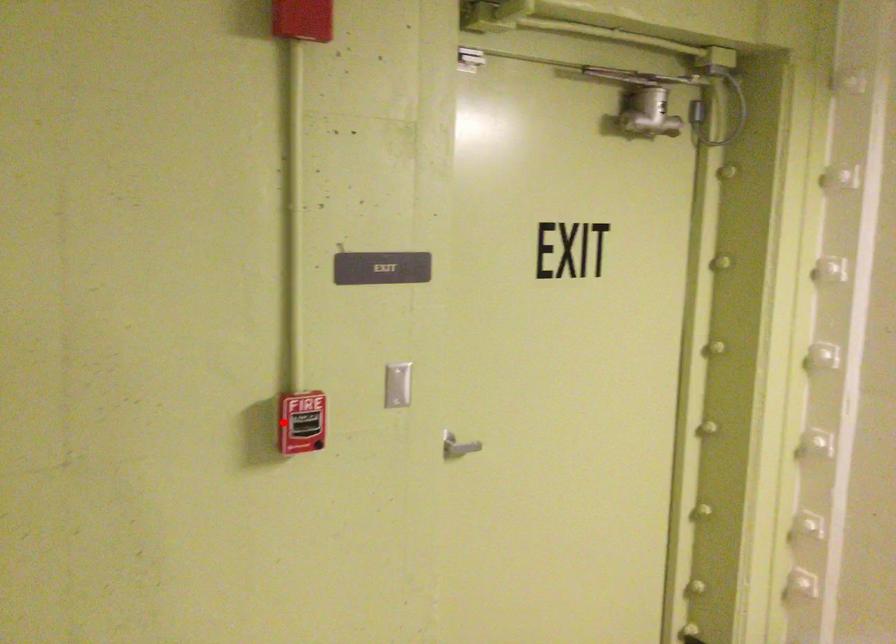
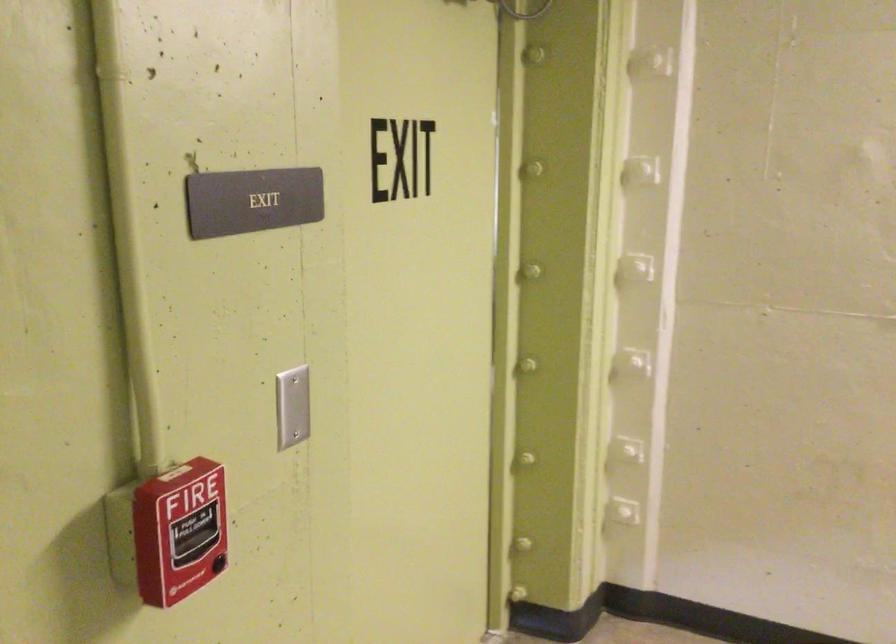
In the second image, find the point that corresponds to the highlighted location in the first image.

(179, 532)